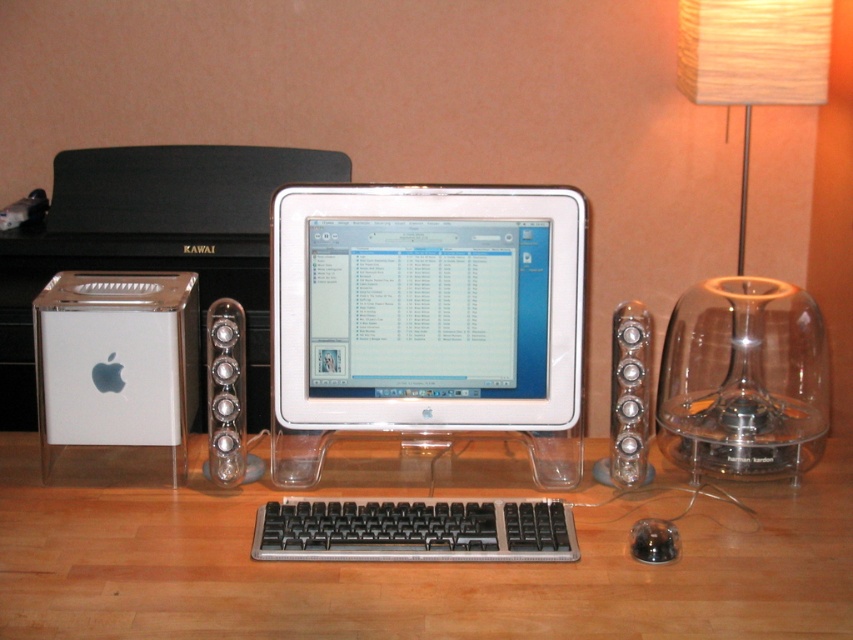
You are looking at the computer workstation setup. There is a point at coordinates (426, 320). Which object is located at that point?

The point at coordinates (426, 320) corresponds to the white glossy monitor at center.

You are setting up a new lamp next to the translucent glass dome at right and the silver metallic speaker at right. Which object should you place the lamp farther away from to avoid blocking the view of the taller one?

The translucent glass dome at right is much taller than the silver metallic speaker at right, so you should place the lamp farther away from the translucent glass dome at right to avoid blocking its view.